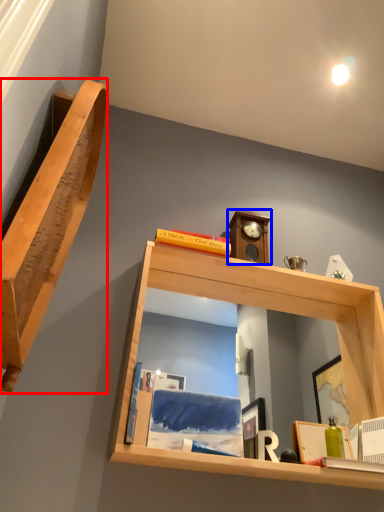
Question: Among these objects, which one is nearest to the camera, shelf (highlighted by a red box) or clock (highlighted by a blue box)?

Choices:
 (A) shelf
 (B) clock

Answer: (A)